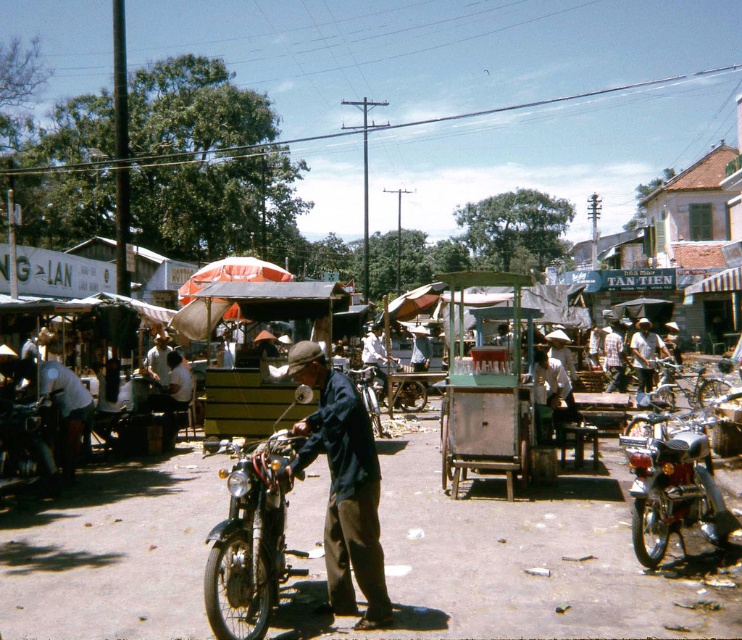
Question: Does dark blue fabric at center appear on the right side of shiny black motorcycle at center?

Choices:
 (A) no
 (B) yes

Answer: (B)

Question: Which point is closer to the camera?

Choices:
 (A) dark blue fabric at center
 (B) shiny black motorcycle at center

Answer: (B)

Question: Can you confirm if wooden cart at center is bigger than light brown fabric hat at center?

Choices:
 (A) yes
 (B) no

Answer: (B)

Question: Which of the following is the closest to the observer?

Choices:
 (A) light brown fabric hat at center
 (B) wooden cart at center

Answer: (B)

Question: Is wooden cart at center below dark blue fabric at center?

Choices:
 (A) no
 (B) yes

Answer: (B)

Question: Which object is closer to the camera taking this photo?

Choices:
 (A) dark blue fabric at center
 (B) shiny black motorcycle at center
 (C) wooden cart at center

Answer: (B)